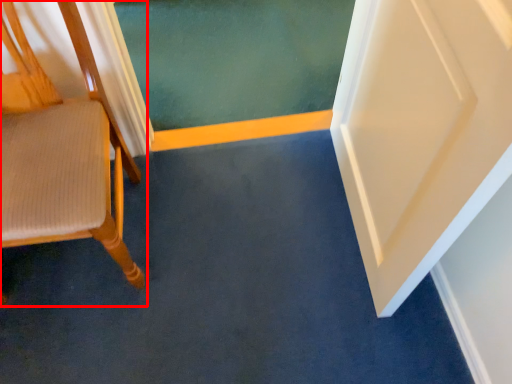
Question: From the image's perspective, where is chair (annotated by the red box) located relative to strip?

Choices:
 (A) below
 (B) above

Answer: (A)